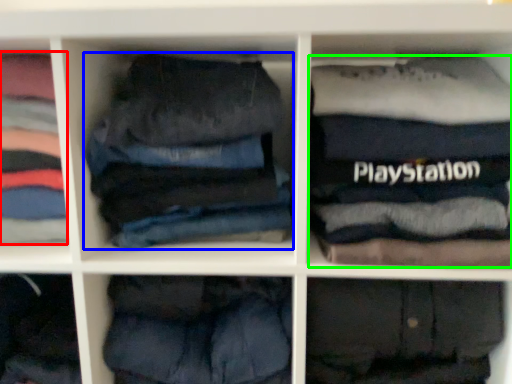
Question: Estimate the real-world distances between objects in this image. Which object is farther from clothing (highlighted by a red box), trousers (highlighted by a blue box) or clothing (highlighted by a green box)?

Choices:
 (A) trousers
 (B) clothing

Answer: (B)